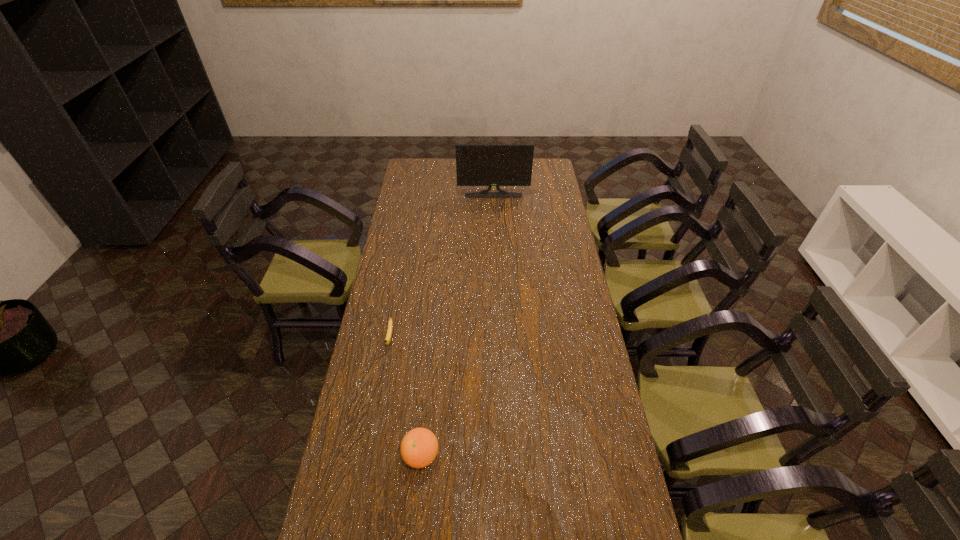
The width and height of the screenshot is (960, 540). I want to click on the tallest object, so click(x=489, y=165).

The image size is (960, 540). I want to click on monitor, so click(x=489, y=165).

Find the location of `orange`. orange is located at coordinates (419, 447).

Where is `the second tallest object`? The width and height of the screenshot is (960, 540). the second tallest object is located at coordinates (419, 447).

I want to click on the second nearest object, so click(x=387, y=340).

Image resolution: width=960 pixels, height=540 pixels. Identify the location of the leftmost object. (387, 340).

Locate an element on the screen. vacant space located 0.340m on the front-facing side of the rightmost object is located at coordinates (495, 240).

The image size is (960, 540). What are the coordinates of `vacant region located 0.220m on the right of the second shortest object` in the screenshot? It's located at (514, 456).

Image resolution: width=960 pixels, height=540 pixels. Identify the location of free spot located 0.190m at the stem of the banana. (378, 399).

Locate an element on the screen. The image size is (960, 540). object present at the left edge is located at coordinates (387, 340).